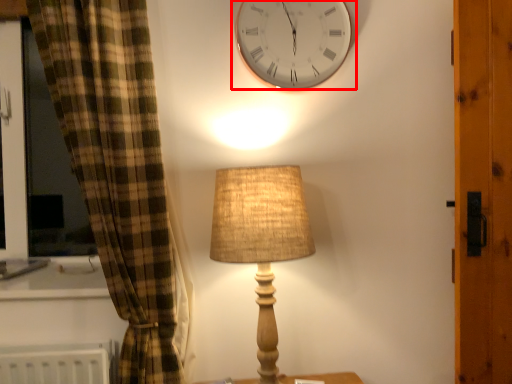
Question: From the image's perspective, where is wall clock (annotated by the red box) located in relation to lamp in the image?

Choices:
 (A) above
 (B) below

Answer: (A)